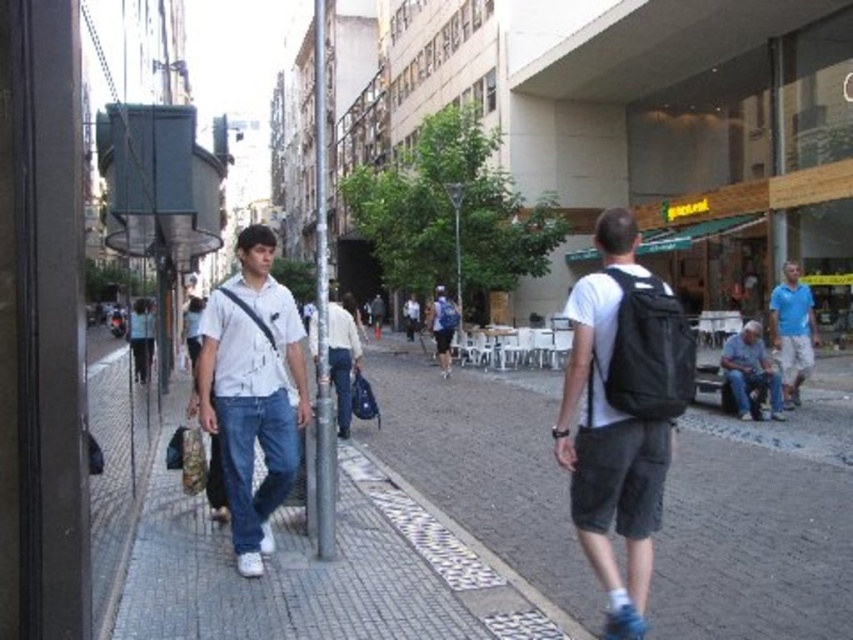
Between brick pavement at center and white matte shirt at center, which one has more height?

Standing taller between the two is white matte shirt at center.

Does brick pavement at center appear under white matte shirt at center?

Correct, brick pavement at center is located below white matte shirt at center.

In order to click on brick pavement at center in this screenshot , I will do `click(757, 529)`.

How much distance is there between black matte backpack at center and blue cotton shirt at right?

black matte backpack at center and blue cotton shirt at right are 9.79 meters apart from each other.

Which of these two, black matte backpack at center or blue cotton shirt at right, stands taller?

Standing taller between the two is black matte backpack at center.

Find the location of a particular element. black matte backpack at center is located at coordinates (622, 413).

Can you confirm if smooth concrete sidewalk at center is positioned above black matte backpack at center?

No.

Does smooth concrete sidewalk at center lie in front of black matte backpack at center?

No, smooth concrete sidewalk at center is further to the viewer.

At what (x,y) coordinates should I click in order to perform the action: click on smooth concrete sidewalk at center. Please return your answer as a coordinate pair (x, y). The width and height of the screenshot is (853, 640). Looking at the image, I should click on (328, 572).

At what (x,y) coordinates should I click in order to perform the action: click on smooth concrete sidewalk at center. Please return your answer as a coordinate pair (x, y). Looking at the image, I should click on (328, 572).